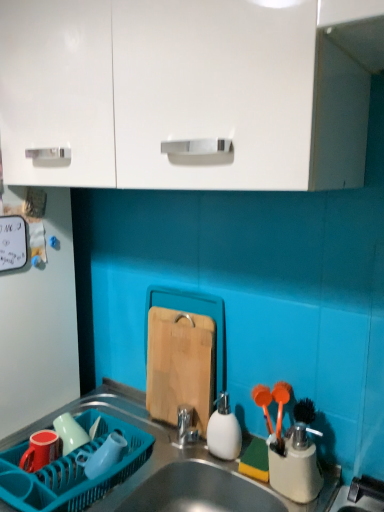
Locate an element on the screen. free location in front of matte ceramic mug at lower left, the 4th tableware positioned from the right is located at coordinates (30, 486).